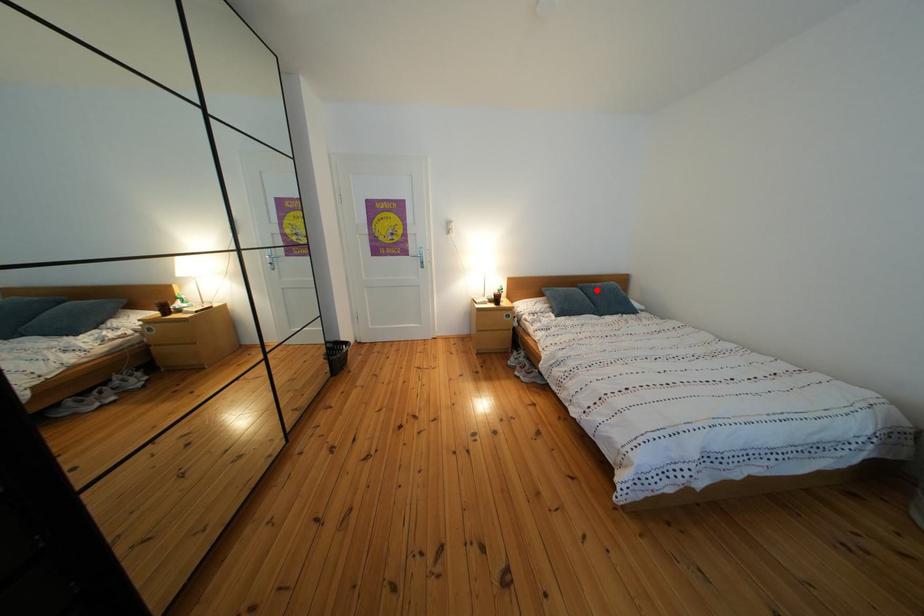
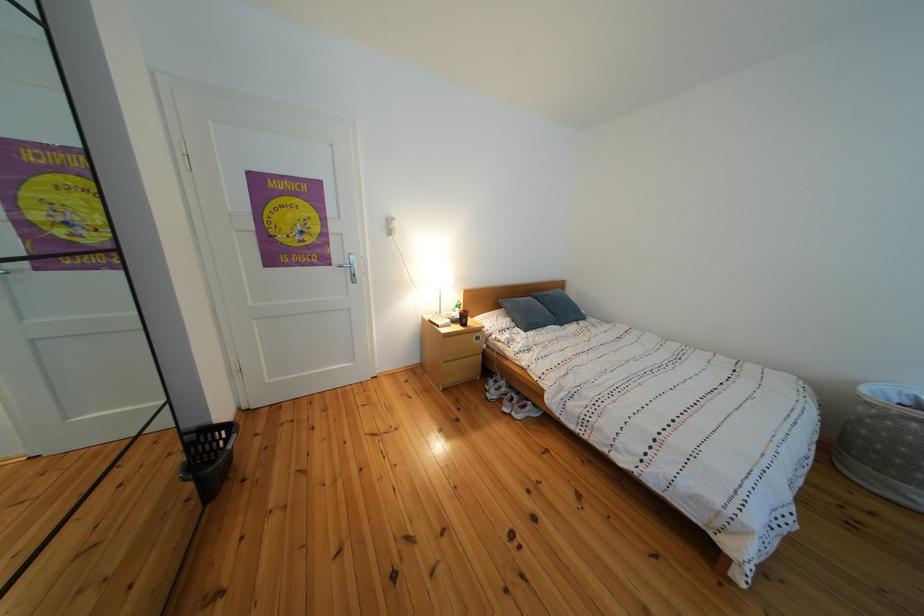
In the second image, find the point that corresponds to the highlighted location in the first image.

(552, 300)